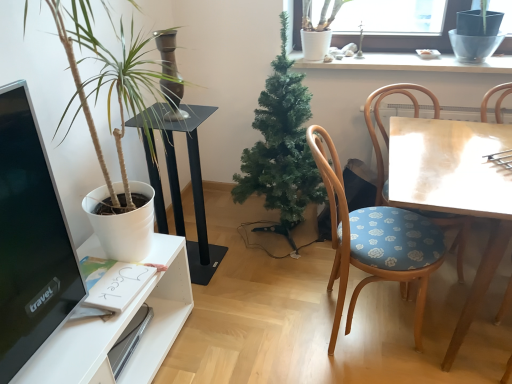
What is the approximate height of wooden chair with blue floral cushion at right, arranged as the second chair when viewed from the right?

It is 88.31 centimeters.

Locate an element on the screen. The width and height of the screenshot is (512, 384). clear glass window at upper center is located at coordinates (419, 36).

What do you see at coordinates (109, 82) in the screenshot?
I see `white matte plant at left, arranged as the second houseplant when viewed from the right` at bounding box center [109, 82].

Measure the distance between point (96,132) and camera.

Point (96,132) and camera are 1.53 meters apart from each other.

At what (x,y) coordinates should I click in order to perform the action: click on wooden chair with blue floral cushion at right, arranged as the second chair when viewed from the right. Please return your answer as a coordinate pair (x, y). The image size is (512, 384). Looking at the image, I should click on (374, 241).

Does point (380, 210) appear closer or farther from the camera than point (380, 168)?

Point (380, 210).

From the image's perspective, which one is positioned higher, wooden chair with blue floral cushion at right, positioned as the first chair in left-to-right order, or wooden chair with floral cushion at right, placed as the second chair when sorted from left to right?

wooden chair with floral cushion at right, placed as the second chair when sorted from left to right.

Can you tell me how much wooden chair with blue floral cushion at right, arranged as the second chair when viewed from the right, and wooden chair with floral cushion at right, placed as the first chair when sorted from right to left, differ in facing direction?

wooden chair with blue floral cushion at right, arranged as the second chair when viewed from the right, and wooden chair with floral cushion at right, placed as the first chair when sorted from right to left, are facing 61.8 degrees away from each other.

Which object is more forward, wooden chair with blue floral cushion at right, arranged as the second chair when viewed from the right, or wooden chair with floral cushion at right, placed as the second chair when sorted from left to right?

wooden chair with blue floral cushion at right, arranged as the second chair when viewed from the right, is closer to the camera.

Based on the photo, is green artificial tree at center, positioned as the 2th houseplant in left-to-right order, aimed at white matte plant at left, the 1th houseplant in the left-to-right sequence?

No, green artificial tree at center, positioned as the 2th houseplant in left-to-right order, is not facing towards white matte plant at left, the 1th houseplant in the left-to-right sequence.

How distant is green artificial tree at center, which is counted as the 1th houseplant, starting from the right, from white matte plant at left, arranged as the second houseplant when viewed from the right?

A distance of 57.83 centimeters exists between green artificial tree at center, which is counted as the 1th houseplant, starting from the right, and white matte plant at left, arranged as the second houseplant when viewed from the right.

Which object is wider, green artificial tree at center, positioned as the 2th houseplant in left-to-right order, or white matte plant at left, the 1th houseplant in the left-to-right sequence?

white matte plant at left, the 1th houseplant in the left-to-right sequence, is wider.

Is green artificial tree at center, which is counted as the 1th houseplant, starting from the right, spatially inside white matte plant at left, the 1th houseplant in the left-to-right sequence, or outside of it?

green artificial tree at center, which is counted as the 1th houseplant, starting from the right, lies outside white matte plant at left, the 1th houseplant in the left-to-right sequence.

Does wooden chair with floral cushion at right, placed as the first chair when sorted from right to left, turn towards green artificial tree at center, positioned as the 2th houseplant in left-to-right order?

No.

Between wooden chair with floral cushion at right, placed as the second chair when sorted from left to right, and green artificial tree at center, which is counted as the 1th houseplant, starting from the right, which one appears on the right side from the viewer's perspective?

From the viewer's perspective, wooden chair with floral cushion at right, placed as the second chair when sorted from left to right, appears more on the right side.

Locate an element on the screen. The height and width of the screenshot is (384, 512). houseplant lying behind the wooden chair with floral cushion at right, placed as the first chair when sorted from right to left is located at coordinates (281, 147).

Considering the relative sizes of wooden chair with floral cushion at right, placed as the first chair when sorted from right to left, and green artificial tree at center, positioned as the 2th houseplant in left-to-right order, in the image provided, is wooden chair with floral cushion at right, placed as the first chair when sorted from right to left, wider than green artificial tree at center, positioned as the 2th houseplant in left-to-right order,?

Yes.

From a real-world perspective, is clear glass window at upper center physically above white ceramic vase at upper center?

Correct, in the physical world, clear glass window at upper center is higher than white ceramic vase at upper center.

Looking at this image, does clear glass window at upper center have a lesser width compared to white ceramic vase at upper center?

Indeed, clear glass window at upper center has a lesser width compared to white ceramic vase at upper center.

Based on their positions, is clear glass window at upper center located to the left or right of white ceramic vase at upper center?

clear glass window at upper center is positioned on white ceramic vase at upper center's right side.

Considering the relative sizes of clear glass window at upper center and white ceramic vase at upper center in the image provided, is clear glass window at upper center bigger than white ceramic vase at upper center?

Indeed, clear glass window at upper center has a larger size compared to white ceramic vase at upper center.

From the picture: From the image's perspective, is white ceramic vase at upper center under clear glass window at upper center?

Yes, from the image's perspective, white ceramic vase at upper center is beneath clear glass window at upper center.

From a real-world perspective, is white ceramic vase at upper center above or below clear glass window at upper center?

white ceramic vase at upper center is below clear glass window at upper center.

Do you think white ceramic vase at upper center is within clear glass window at upper center, or outside of it?

white ceramic vase at upper center exists outside the volume of clear glass window at upper center.

The image size is (512, 384). Find the location of `window above the green artificial tree at center, positioned as the 2th houseplant in left-to-right order (from the image's perspective)`. window above the green artificial tree at center, positioned as the 2th houseplant in left-to-right order (from the image's perspective) is located at coordinates (419, 36).

Based on their sizes in the image, would you say green artificial tree at center, positioned as the 2th houseplant in left-to-right order, is bigger or smaller than clear glass window at upper center?

green artificial tree at center, positioned as the 2th houseplant in left-to-right order, is bigger than clear glass window at upper center.

Is green artificial tree at center, positioned as the 2th houseplant in left-to-right order, not within clear glass window at upper center?

Yes.

Who is more distant, green artificial tree at center, which is counted as the 1th houseplant, starting from the right, or clear glass window at upper center?

clear glass window at upper center.

Visually, is wooden table at right positioned to the left or to the right of black glossy computer monitor at left?

Based on their positions, wooden table at right is located to the right of black glossy computer monitor at left.

Find the location of a particular element. computer monitor in front of the wooden table at right is located at coordinates (30, 238).

Is point (426, 198) closer or farther from the camera than point (50, 231)?

Point (426, 198).

Could you tell me if wooden table at right is facing black glossy computer monitor at left?

No, wooden table at right is not facing towards black glossy computer monitor at left.

Image resolution: width=512 pixels, height=384 pixels. In order to click on chair behind the wooden chair with blue floral cushion at right, arranged as the second chair when viewed from the right in this screenshot , I will do `click(384, 127)`.

Image resolution: width=512 pixels, height=384 pixels. Find the location of `houseplant that is under the white matte plant at left, the 1th houseplant in the left-to-right sequence (from a real-world perspective)`. houseplant that is under the white matte plant at left, the 1th houseplant in the left-to-right sequence (from a real-world perspective) is located at coordinates (281, 147).

From the image, which object appears to be nearer to clear glass window at upper center, wooden chair with floral cushion at right, placed as the first chair when sorted from right to left, or green artificial tree at center, positioned as the 2th houseplant in left-to-right order?

wooden chair with floral cushion at right, placed as the first chair when sorted from right to left, is positioned closer to the anchor clear glass window at upper center.

Estimate the real-world distances between objects in this image. Which object is further from clear glass window at upper center, wooden chair with floral cushion at right, placed as the second chair when sorted from left to right, or black glossy computer monitor at left?

black glossy computer monitor at left lies further to clear glass window at upper center than the other object.

When comparing their distances from green artificial tree at center, positioned as the 2th houseplant in left-to-right order, does black glossy computer monitor at left or wooden table at right seem further?

black glossy computer monitor at left lies further to green artificial tree at center, positioned as the 2th houseplant in left-to-right order, than the other object.

Based on their spatial positions, is white matte plant at left, arranged as the second houseplant when viewed from the right, or black glossy computer monitor at left closer to green artificial tree at center, positioned as the 2th houseplant in left-to-right order?

The object closer to green artificial tree at center, positioned as the 2th houseplant in left-to-right order, is white matte plant at left, arranged as the second houseplant when viewed from the right.

From the image, which object appears to be farther from wooden chair with blue floral cushion at right, arranged as the second chair when viewed from the right, green artificial tree at center, which is counted as the 1th houseplant, starting from the right, or black glass table at center?

black glass table at center is further to wooden chair with blue floral cushion at right, arranged as the second chair when viewed from the right.

Considering their positions, is white matte plant at left, arranged as the second houseplant when viewed from the right, positioned further to green artificial tree at center, which is counted as the 1th houseplant, starting from the right, than wooden chair with blue floral cushion at right, arranged as the second chair when viewed from the right?

Result: white matte plant at left, arranged as the second houseplant when viewed from the right, is positioned further to the anchor green artificial tree at center, which is counted as the 1th houseplant, starting from the right.

When comparing their distances from green artificial tree at center, which is counted as the 1th houseplant, starting from the right, does white ceramic vase at upper center or black glossy computer monitor at left seem closer?

white ceramic vase at upper center.

Which object lies nearer to the anchor point black glossy computer monitor at left, clear glass window at upper center or black glass table at center?

black glass table at center is positioned closer to the anchor black glossy computer monitor at left.

At what (x,y) coordinates should I click in order to perform the action: click on houseplant located between white matte plant at left, the 1th houseplant in the left-to-right sequence, and wooden table at right in the left-right direction. Please return your answer as a coordinate pair (x, y). This screenshot has height=384, width=512. Looking at the image, I should click on [281, 147].

Find the location of `houseplant located between black glass table at center and wooden chair with blue floral cushion at right, positioned as the first chair in left-to-right order, in the left-right direction`. houseplant located between black glass table at center and wooden chair with blue floral cushion at right, positioned as the first chair in left-to-right order, in the left-right direction is located at coordinates (281, 147).

This screenshot has height=384, width=512. I want to click on chair between white ceramic vase at upper center and wooden table at right vertically, so click(x=384, y=127).

You are a GUI agent. You are given a task and a screenshot of the screen. Output one action in this format:
    pyautogui.click(x=<x>, y=<y>)
    Task: Click on the houseplant between black glossy computer monitor at left and green artificial tree at center, which is counted as the 1th houseplant, starting from the right, from front to back
    Image resolution: width=512 pixels, height=384 pixels.
    Given the screenshot: What is the action you would take?
    pyautogui.click(x=109, y=82)